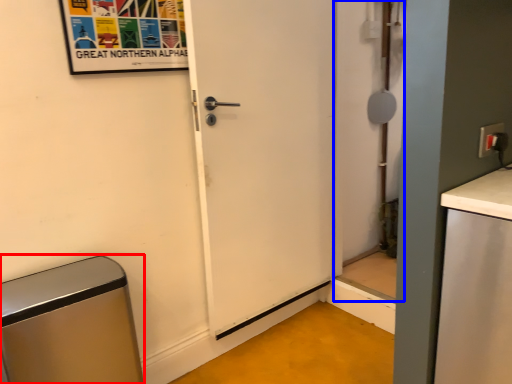
Question: Which of the following is the farthest to the observer, appliance (highlighted by a red box) or screen door (highlighted by a blue box)?

Choices:
 (A) appliance
 (B) screen door

Answer: (B)